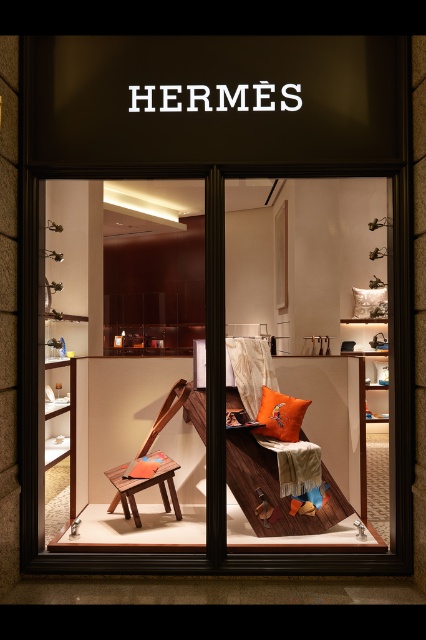
Question: Does wooden bench at center appear on the right side of orange fabric pillow at center?

Choices:
 (A) no
 (B) yes

Answer: (A)

Question: Which of the following is the farthest from the observer?

Choices:
 (A) (111, 481)
 (B) (270, 429)
 (C) (383, 401)
 (D) (172, 403)

Answer: (C)

Question: Can you confirm if orange fabric cushion at center is smaller than wooden stool at center?

Choices:
 (A) no
 (B) yes

Answer: (B)

Question: Among these points, which one is nearest to the camera?

Choices:
 (A) (259, 420)
 (B) (111, 508)
 (C) (178, 502)
 (D) (345, 221)

Answer: (A)

Question: Considering the relative positions of wooden bench at center and wooden chair at center in the image provided, where is wooden bench at center located with respect to wooden chair at center?

Choices:
 (A) right
 (B) left

Answer: (A)

Question: Which object is the closest to the wooden bench at center?

Choices:
 (A) wooden chair at center
 (B) orange fabric cushion at center
 (C) orange fabric pillow at center
 (D) wooden stool at center

Answer: (A)